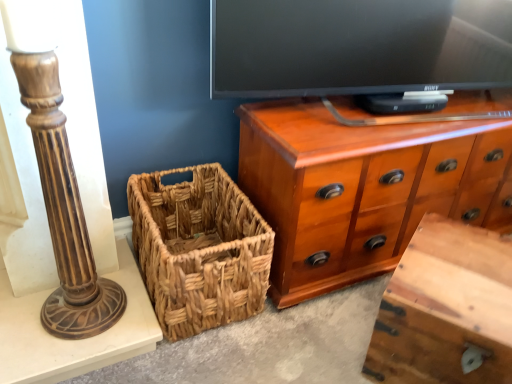
Question: Is wooden vanity at lower right shorter than woven brown picnic basket at lower left?

Choices:
 (A) yes
 (B) no

Answer: (A)

Question: Is wooden vanity at lower right facing towards woven brown picnic basket at lower left?

Choices:
 (A) no
 (B) yes

Answer: (A)

Question: Does wooden vanity at lower right have a greater height compared to woven brown picnic basket at lower left?

Choices:
 (A) yes
 (B) no

Answer: (B)

Question: Considering the relative sizes of wooden vanity at lower right and woven brown picnic basket at lower left in the image provided, is wooden vanity at lower right thinner than woven brown picnic basket at lower left?

Choices:
 (A) yes
 (B) no

Answer: (A)

Question: Considering the relative sizes of wooden vanity at lower right and woven brown picnic basket at lower left in the image provided, is wooden vanity at lower right smaller than woven brown picnic basket at lower left?

Choices:
 (A) no
 (B) yes

Answer: (A)

Question: Based on their sizes in the image, would you say shiny brown wood chest of drawers at upper right is bigger or smaller than wooden vanity at lower right?

Choices:
 (A) small
 (B) big

Answer: (B)

Question: Does point (338, 226) appear closer or farther from the camera than point (487, 264)?

Choices:
 (A) closer
 (B) farther

Answer: (B)

Question: Is shiny brown wood chest of drawers at upper right in front of or behind wooden vanity at lower right in the image?

Choices:
 (A) behind
 (B) front

Answer: (A)

Question: Would you say shiny brown wood chest of drawers at upper right is to the left or to the right of wooden vanity at lower right in the picture?

Choices:
 (A) right
 (B) left

Answer: (B)

Question: From the image's perspective, is woven brown picnic basket at lower left above or below shiny brown wood chest of drawers at upper right?

Choices:
 (A) below
 (B) above

Answer: (A)

Question: In terms of width, does woven brown picnic basket at lower left look wider or thinner when compared to shiny brown wood chest of drawers at upper right?

Choices:
 (A) thin
 (B) wide

Answer: (B)

Question: Visually, is woven brown picnic basket at lower left positioned to the left or to the right of shiny brown wood chest of drawers at upper right?

Choices:
 (A) left
 (B) right

Answer: (A)

Question: Is woven brown picnic basket at lower left bigger or smaller than shiny brown wood chest of drawers at upper right?

Choices:
 (A) big
 (B) small

Answer: (B)

Question: Does point (x=458, y=370) appear closer or farther from the camera than point (x=173, y=249)?

Choices:
 (A) closer
 (B) farther

Answer: (A)

Question: From the image's perspective, is wooden vanity at lower right positioned above or below woven brown picnic basket at lower left?

Choices:
 (A) above
 (B) below

Answer: (B)